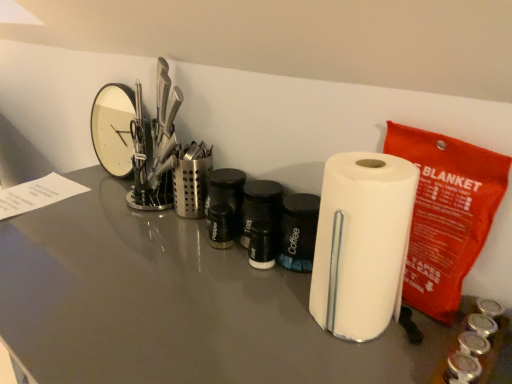
Find the location of `free space in front of white matte paper towel at center`. free space in front of white matte paper towel at center is located at coordinates (357, 360).